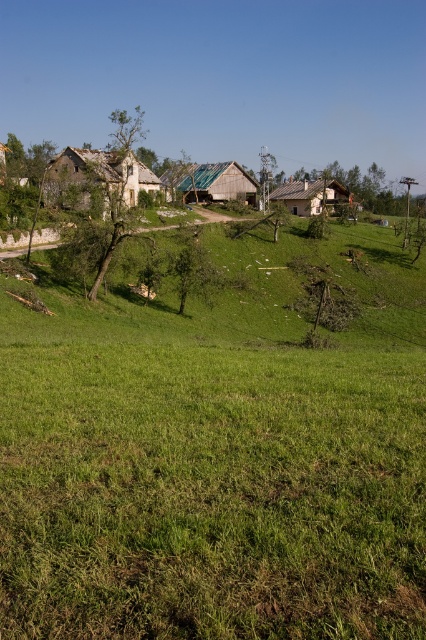
The height and width of the screenshot is (640, 426). What do you see at coordinates (97, 179) in the screenshot?
I see `rustic wooden hut at center-left` at bounding box center [97, 179].

Is rustic wooden hut at center-left bigger than green leafy tree at center?

Indeed, rustic wooden hut at center-left has a larger size compared to green leafy tree at center.

Is point (132, 188) positioned behind point (187, 276)?

That is True.

Where is `rustic wooden hut at center-left`? The height and width of the screenshot is (640, 426). rustic wooden hut at center-left is located at coordinates (97, 179).

Who is taller, rustic wooden hut at center-left or wooden hut at center?

rustic wooden hut at center-left is taller.

Can you confirm if rustic wooden hut at center-left is smaller than wooden hut at center?

No, rustic wooden hut at center-left is not smaller than wooden hut at center.

Is point (104, 161) positioned before point (175, 177)?

That is True.

You are a GUI agent. You are given a task and a screenshot of the screen. Output one action in this format:
    pyautogui.click(x=<x>, y=<y>)
    Task: Click on the rustic wooden hut at center-left
    
    Given the screenshot: What is the action you would take?
    pyautogui.click(x=97, y=179)

Is point (210, 266) more distant than point (310, 180)?

No, it is not.

Who is more distant from viewer, (184, 280) or (345, 202)?

The point (345, 202) is behind.

Who is more distant from viewer, [178,269] or [307,212]?

Point [307,212]

This screenshot has width=426, height=640. What are the coordinates of `green leafy tree at center` in the screenshot? It's located at (193, 273).